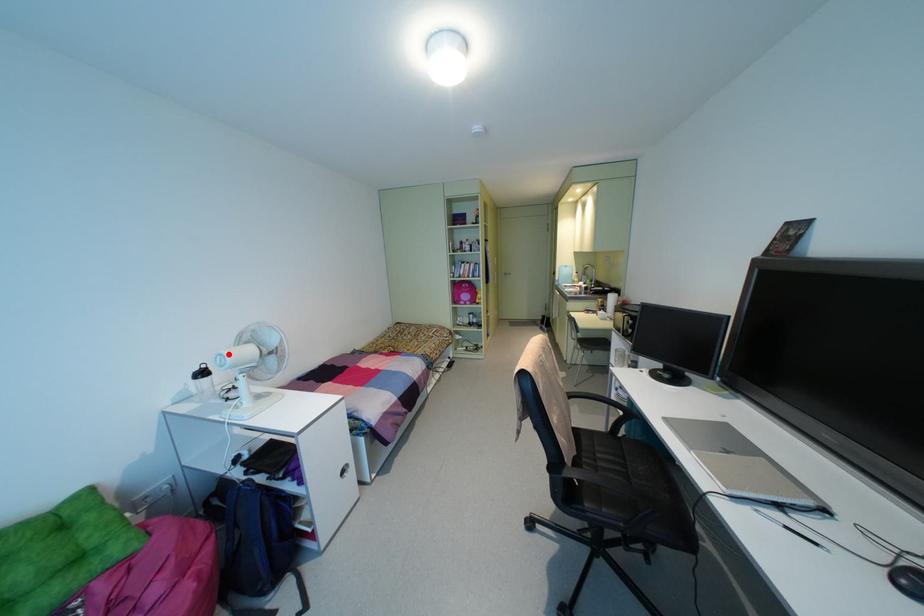
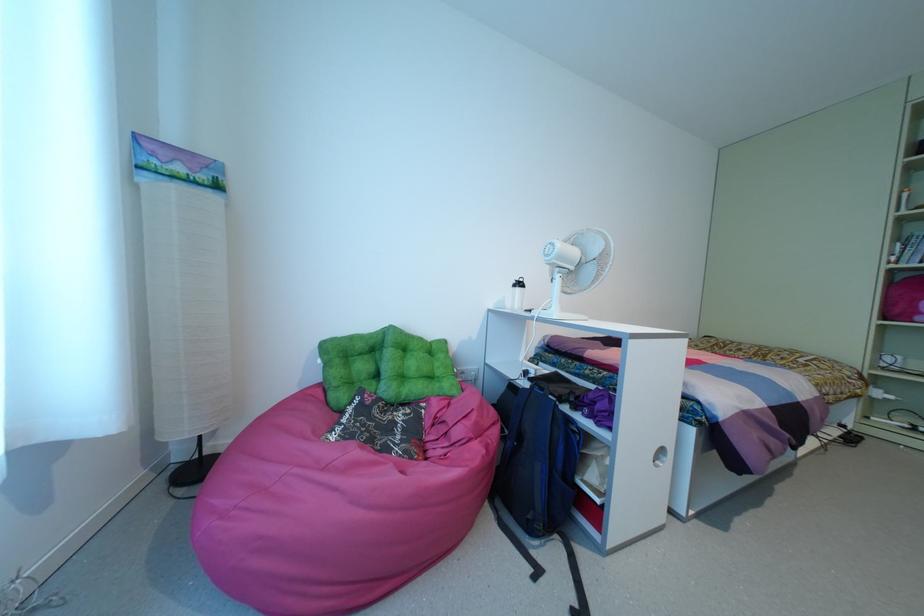
Question: I am providing you with two images of the same scene from different viewpoints. A red point is marked on the first image. Can you still see the location of the red point in image 2?

Choices:
 (A) Yes
 (B) No

Answer: (A)